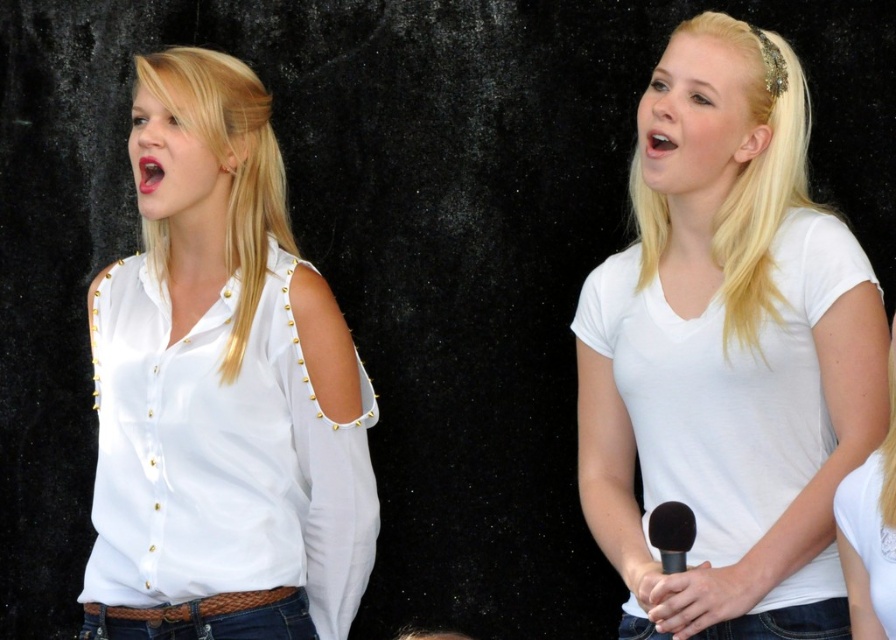
You are a photographer setting up for a group photo. You notice two shirts in the scene, the white matte shirt at center and the white studded shirt at left. Which shirt should you adjust to ensure both are visible in the frame, considering their sizes?

The white matte shirt at center is larger than the white studded shirt at left, so you should adjust the white studded shirt at left to ensure both are visible in the frame.

You are a photographer setting up for a concert. You need to position a spotlight so it shines directly on the white matte shirt at center. According to the coordinates provided, where should you aim the spotlight?

The white matte shirt at center is located at point (728, 352), so you should aim the spotlight at those coordinates to ensure it shines directly on the white matte shirt at center.